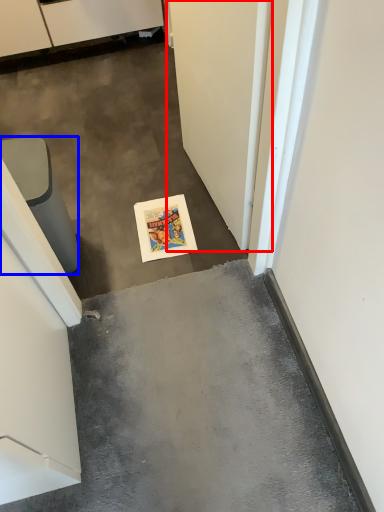
Question: Which object appears farthest to the camera in this image, door (highlighted by a red box) or furniture (highlighted by a blue box)?

Choices:
 (A) door
 (B) furniture

Answer: (B)